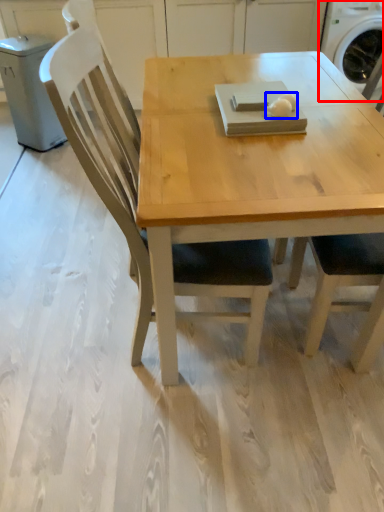
Question: Among these objects, which one is farthest to the camera, washing machine (highlighted by a red box) or food (highlighted by a blue box)?

Choices:
 (A) washing machine
 (B) food

Answer: (A)